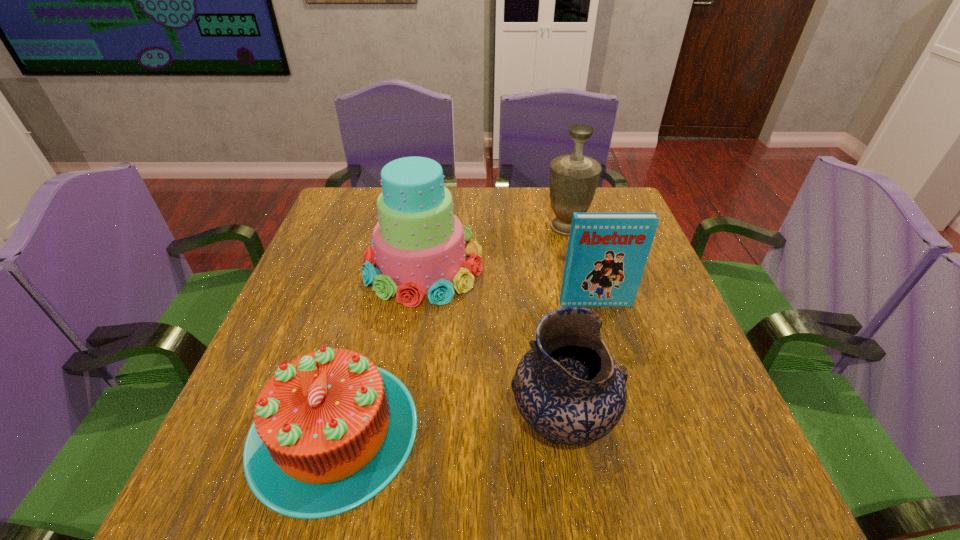
In the image, there is a desktop. Where is `free space at the far edge`? The width and height of the screenshot is (960, 540). free space at the far edge is located at coordinates (519, 200).

Image resolution: width=960 pixels, height=540 pixels. I want to click on vacant space at the near edge of the desktop, so click(440, 503).

This screenshot has height=540, width=960. What are the coordinates of `vacant point at the left edge` in the screenshot? It's located at (257, 360).

You are a GUI agent. You are given a task and a screenshot of the screen. Output one action in this format:
    pyautogui.click(x=<x>, y=<y>)
    Task: Click on the vacant area at the right edge
    
    Given the screenshot: What is the action you would take?
    coord(672,437)

Where is `vacant area at the near left corner`? Image resolution: width=960 pixels, height=540 pixels. vacant area at the near left corner is located at coordinates (228, 463).

Identify the location of vacant space at the near right corner of the desktop. The image size is (960, 540). (733, 481).

Where is `free space between the pottery and the shortest object`? free space between the pottery and the shortest object is located at coordinates (447, 426).

What are the coordinates of `vacant space that's between the taller cake and the pottery` in the screenshot? It's located at (492, 343).

Find the location of a particular element. The image size is (960, 540). free space between the farther cake and the urn is located at coordinates (495, 246).

Where is `free spot between the book and the farther cake`? free spot between the book and the farther cake is located at coordinates (510, 284).